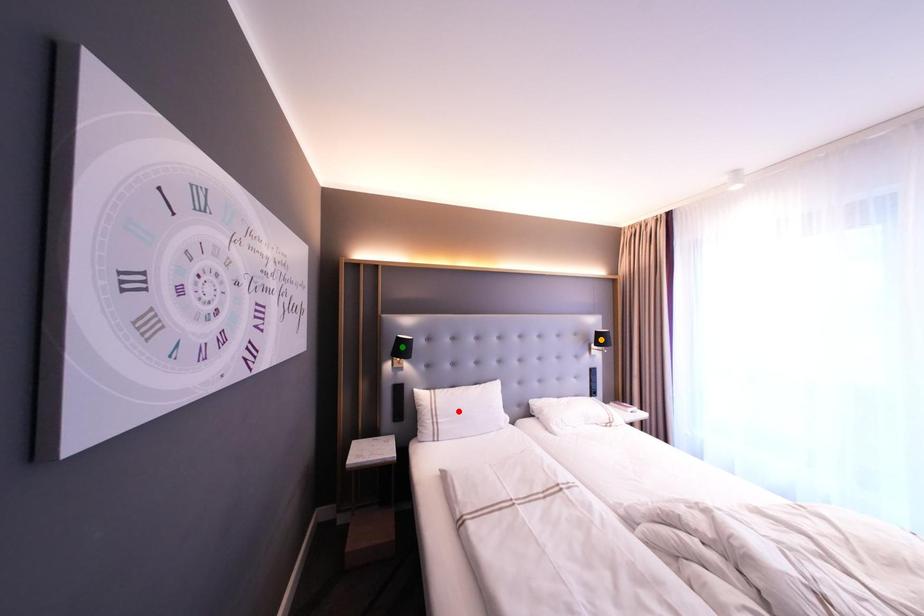
Order these from farthest to nearest:
- red point
- orange point
- green point

orange point
red point
green point